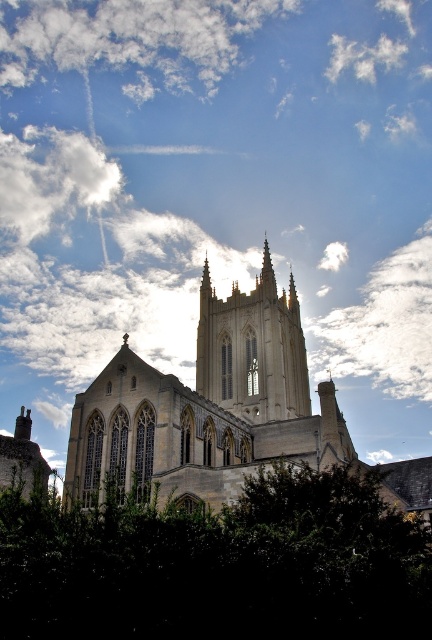
Is the position of white stone tower at center less distant than that of white fluffy cloud at upper right?

Yes, white stone tower at center is closer to the viewer.

Does white stone tower at center have a greater width compared to white fluffy cloud at upper right?

No, white stone tower at center is not wider than white fluffy cloud at upper right.

Identify the location of white stone tower at center. (253, 348).

Does green leafy tree at lower center have a smaller size compared to golden stone church at center?

Indeed, green leafy tree at lower center has a smaller size compared to golden stone church at center.

Is point (66, 620) less distant than point (251, 317)?

Yes, it is in front of point (251, 317).

At what (x,y) coordinates should I click in order to perform the action: click on green leafy tree at lower center. Please return your answer as a coordinate pair (x, y). Looking at the image, I should click on (219, 564).

Can you confirm if green leafy tree at lower center is bigger than white fluffy cloud at upper center?

No, green leafy tree at lower center is not bigger than white fluffy cloud at upper center.

Does green leafy tree at lower center appear under white fluffy cloud at upper center?

Yes.

What do you see at coordinates (219, 564) in the screenshot? The width and height of the screenshot is (432, 640). I see `green leafy tree at lower center` at bounding box center [219, 564].

The image size is (432, 640). In order to click on green leafy tree at lower center in this screenshot , I will do `click(219, 564)`.